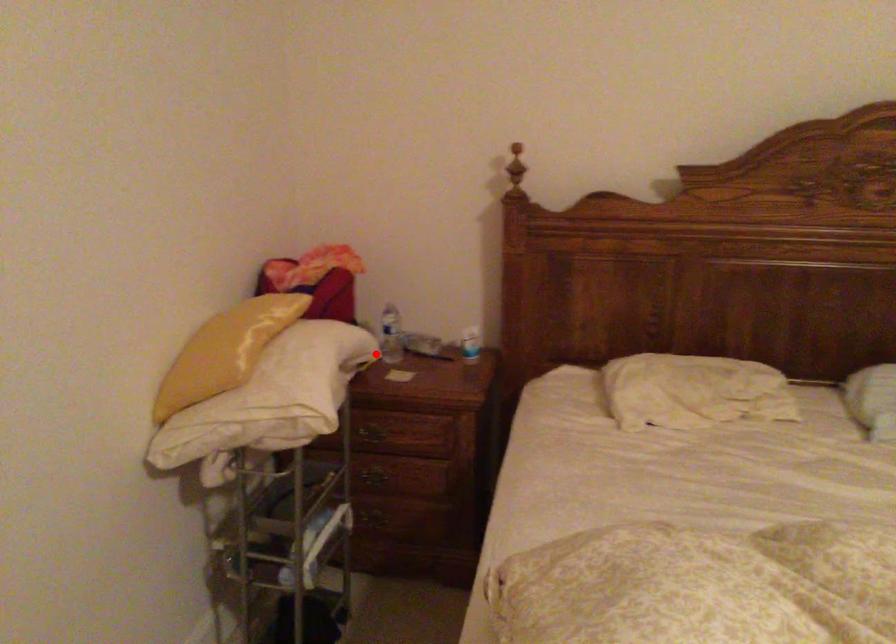
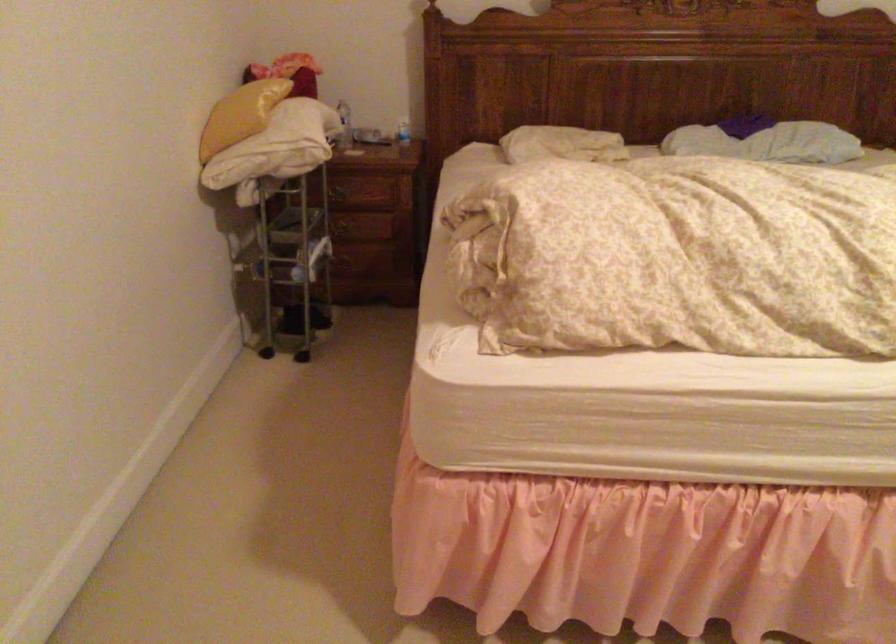
Question: I am providing you with two images of the same scene from different viewpoints. A red point is shown in image1. For the corresponding object point in image2, is it positioned nearer or farther from the camera?

Choices:
 (A) Nearer
 (B) Farther

Answer: (B)